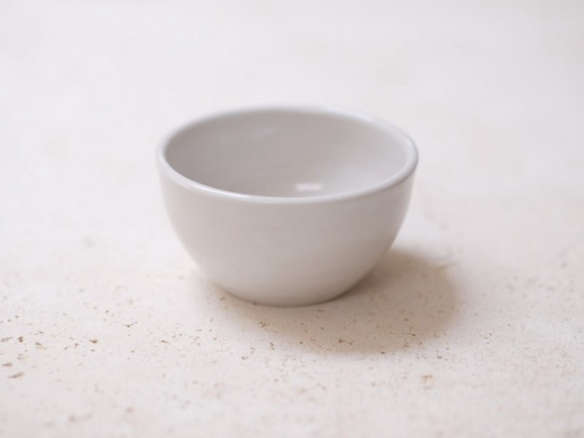
I want to click on inside of cup, so click(x=281, y=180).